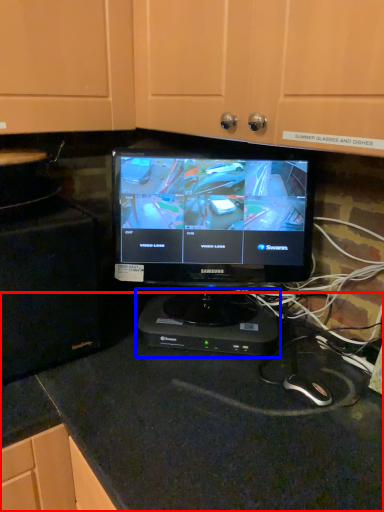
Question: Which point is closer to the camera, counter top (highlighted by a red box) or appliance (highlighted by a blue box)?

Choices:
 (A) counter top
 (B) appliance

Answer: (A)